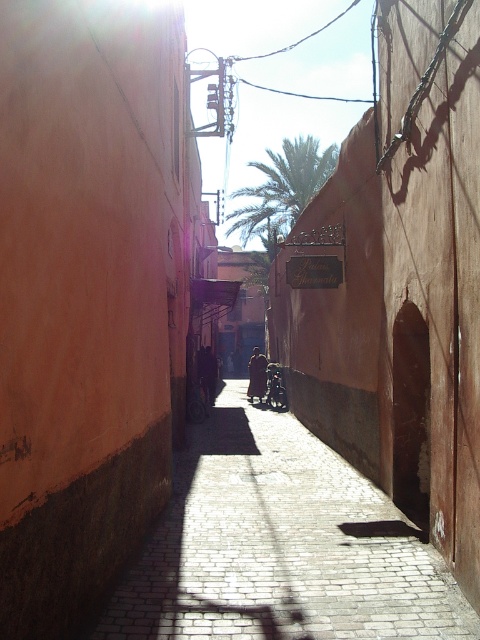
Question: Which of the following is the closest to the observer?

Choices:
 (A) (336, 525)
 (B) (285, 401)
 (C) (310, 188)

Answer: (A)

Question: Which point is farther to the camera?

Choices:
 (A) brick paved path at center
 (B) green leafy palm tree at upper center

Answer: (B)

Question: Can you confirm if brick paved path at center is positioned to the right of wooden baby carriage at center?

Choices:
 (A) no
 (B) yes

Answer: (A)

Question: Does brick paved path at center appear on the right side of wooden baby carriage at center?

Choices:
 (A) yes
 (B) no

Answer: (B)

Question: Which object is closer to the camera taking this photo?

Choices:
 (A) green leafy palm tree at upper center
 (B) wooden baby carriage at center

Answer: (B)

Question: Does green leafy palm tree at upper center appear on the left side of wooden baby carriage at center?

Choices:
 (A) yes
 (B) no

Answer: (B)